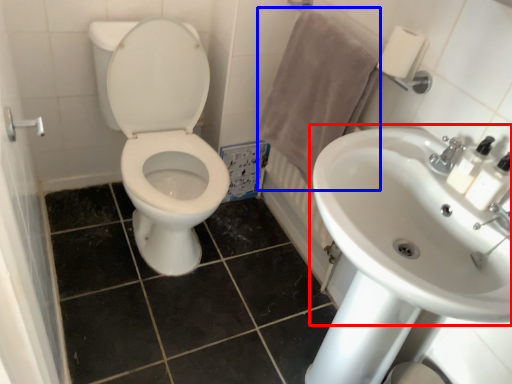
Question: Which object appears closest to the camera in this image, sink (highlighted by a red box) or bath towel (highlighted by a blue box)?

Choices:
 (A) sink
 (B) bath towel

Answer: (A)